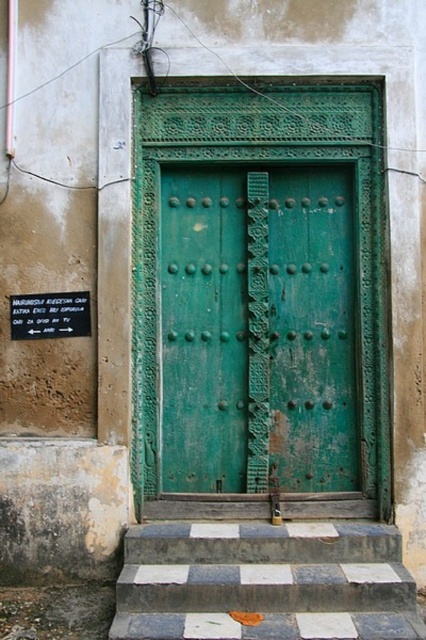
In the scene shown: Does green wooden door at center appear over checkerboard tile stairs at center?

Correct, green wooden door at center is located above checkerboard tile stairs at center.

Is green wooden door at center positioned at the back of checkerboard tile stairs at center?

Yes, it is behind checkerboard tile stairs at center.

Who is more distant from viewer, (201, 340) or (227, 632)?

The point (201, 340) is more distant.

Identify the location of green wooden door at center. (258, 328).

The height and width of the screenshot is (640, 426). What do you see at coordinates (258, 328) in the screenshot?
I see `green wooden door at center` at bounding box center [258, 328].

Who is higher up, green wooden door at center or black plastic sign at lower left?

black plastic sign at lower left is higher up.

Where is `green wooden door at center`? The height and width of the screenshot is (640, 426). green wooden door at center is located at coordinates (258, 328).

The height and width of the screenshot is (640, 426). What are the coordinates of `green wooden door at center` in the screenshot? It's located at (258, 328).

Can you confirm if checkerboard tile stairs at center is shorter than black plastic sign at lower left?

Incorrect, checkerboard tile stairs at center's height does not fall short of black plastic sign at lower left's.

Does point (175, 611) come in front of point (86, 294)?

Yes, it is in front of point (86, 294).

Does point (175, 595) come closer to viewer compared to point (54, 305)?

Yes, it is.

This screenshot has width=426, height=640. I want to click on checkerboard tile stairs at center, so click(x=264, y=582).